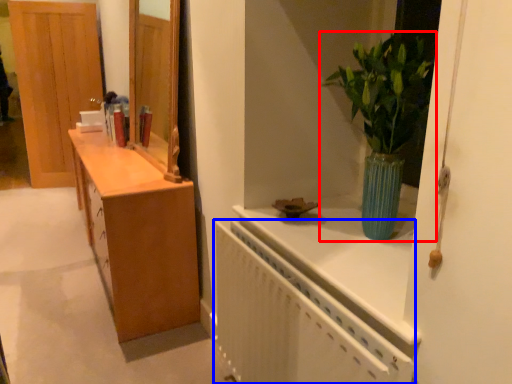
Question: Which of the following is the closest to the observer, houseplant (highlighted by a red box) or radiator (highlighted by a blue box)?

Choices:
 (A) houseplant
 (B) radiator

Answer: (B)